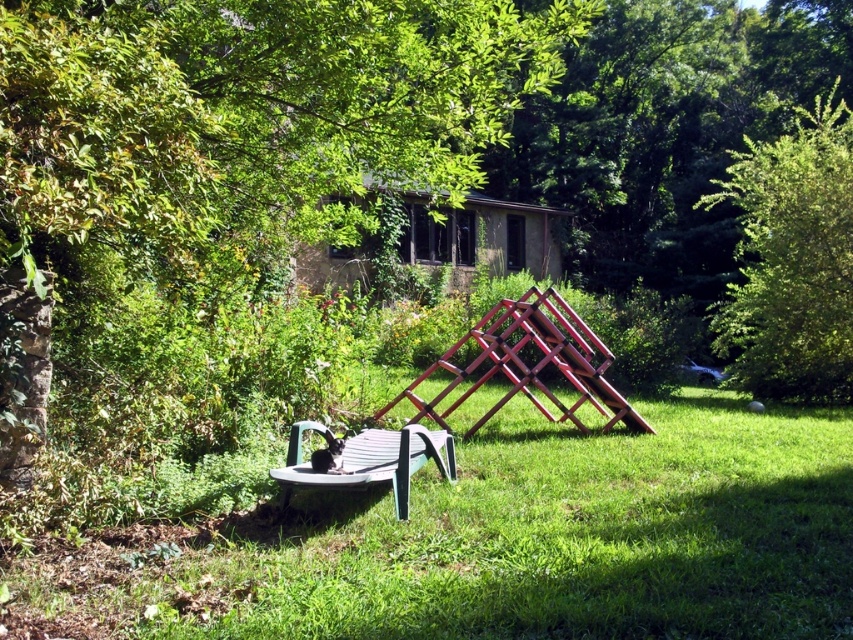
You are standing in the backyard and want to place a new potted plant exactly at the point marked by the coordinates point (531, 362). However, there is already an object at that location. What object is currently occupying that spot?

The wooden chair at center is currently occupying the point marked by the coordinates point (531, 362).

Looking at this image, you are planning to take a photo of the green leafy tree at upper right and the wooden chair at center. Since you want both to be in focus, which object should you position closer to the camera to ensure the tree appears larger in the photo?

To ensure the green leafy tree at upper right appears larger in the photo while keeping both in focus, you should position the wooden chair at center closer to the camera. This way, the tree, which is already larger, will remain prominent in the frame.

You are standing in the backyard and want to take a photo of the green plastic lounge chair with the green leafy tree at upper right in the background. Is the tree positioned in a way that it can be captured in the background of the photo?

The green leafy tree at upper right is located at point (792, 259), which places it in the upper right corner of the image. This position allows it to be included in the background of the photo taken from the green plastic lounge chair area.